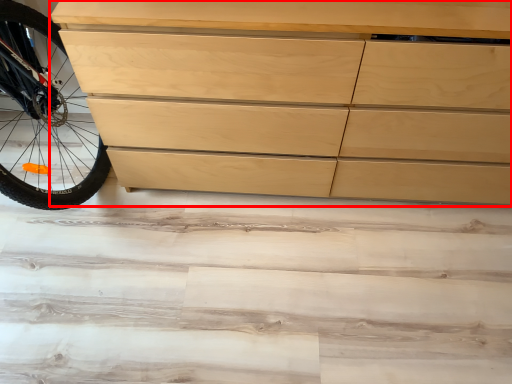
Question: From the image, what is the correct spatial relationship of chest of drawers (annotated by the red box) in relation to stair?

Choices:
 (A) right
 (B) left

Answer: (A)